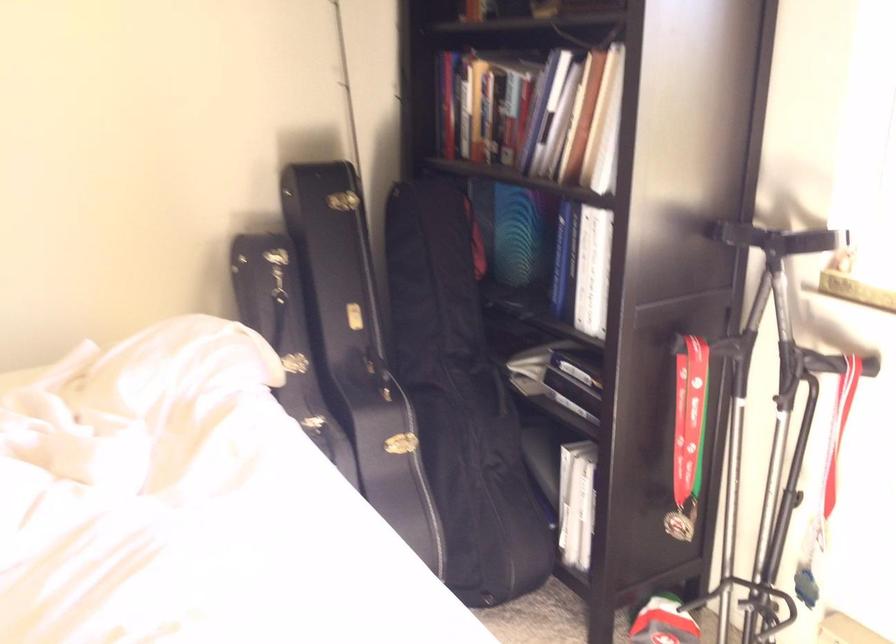
This screenshot has height=644, width=896. What do you see at coordinates (295, 363) in the screenshot? I see `the silver case latch` at bounding box center [295, 363].